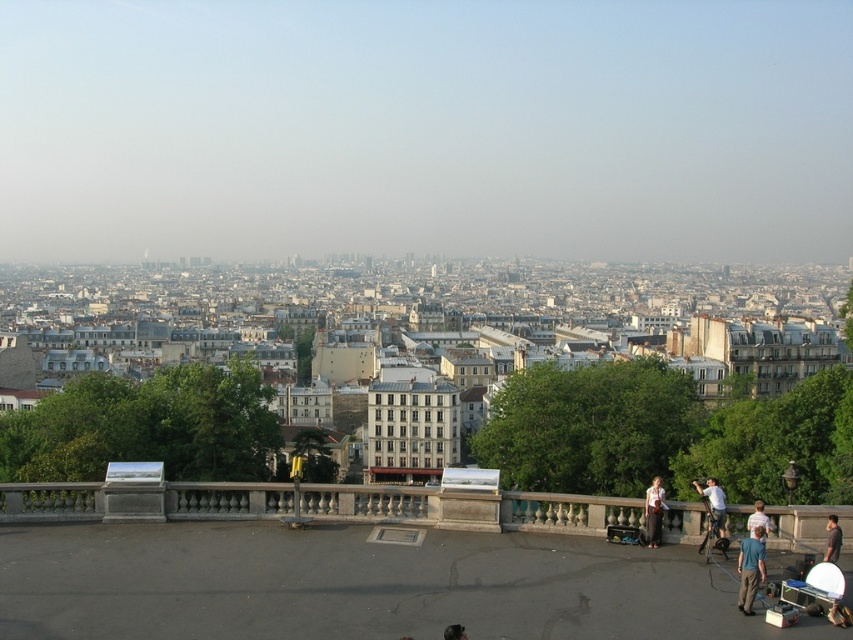
Is point (837, 609) farther from viewer compared to point (708, 497)?

No, (837, 609) is closer to viewer.

Between point (827, 602) and point (723, 509), which one is positioned behind?

Positioned behind is point (723, 509).

Is point (804, 604) less distant than point (718, 529)?

That is True.

I want to click on silver metallic stroller at lower right, so click(x=817, y=593).

Is point (846, 616) positioned before point (746, 554)?

Yes, it is.

From the picture: Does silver metallic stroller at lower right appear over blue fabric shirt at lower right?

No.

Is point (811, 570) less distant than point (746, 547)?

Yes, it is.

Where is `silver metallic stroller at lower right`? The width and height of the screenshot is (853, 640). silver metallic stroller at lower right is located at coordinates (817, 593).

Who is higher up, gray fabric bag at lower right or light brown wooden chair at lower right?

gray fabric bag at lower right is higher up.

This screenshot has height=640, width=853. I want to click on gray fabric bag at lower right, so click(833, 540).

In order to click on gray fabric bag at lower right in this screenshot , I will do `click(833, 540)`.